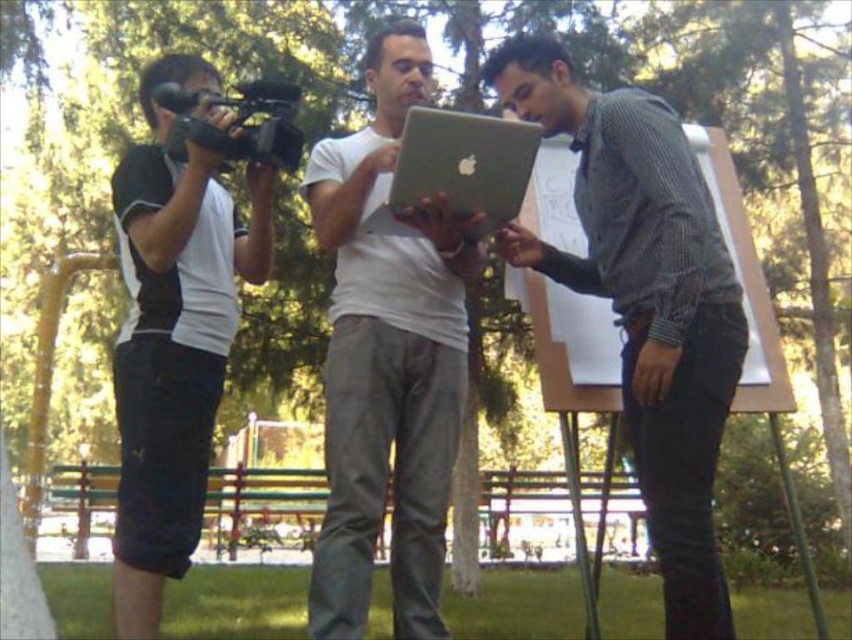
Question: Does matte gray laptop at right appear on the right side of black fabric camera at left?

Choices:
 (A) yes
 (B) no

Answer: (A)

Question: Estimate the real-world distances between objects in this image. Which object is closer to the matte gray laptop at right?

Choices:
 (A) silver metallic laptop at center
 (B) matte silver laptop at center
 (C) black plastic video camera at left

Answer: (A)

Question: Does matte silver laptop at center have a greater width compared to black fabric camera at left?

Choices:
 (A) yes
 (B) no

Answer: (A)

Question: Which object is farther from the camera taking this photo?

Choices:
 (A) black plastic video camera at left
 (B) matte gray laptop at right
 (C) silver metallic laptop at center
 (D) black fabric camera at left

Answer: (A)

Question: Which point appears farthest from the camera in this image?

Choices:
 (A) click(453, 205)
 (B) click(528, 232)
 (C) click(357, 374)
 (D) click(250, 131)

Answer: (B)

Question: Does silver metallic laptop at center have a smaller size compared to black plastic video camera at left?

Choices:
 (A) no
 (B) yes

Answer: (A)